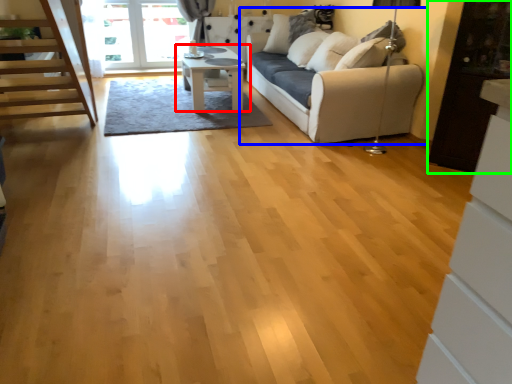
Question: Considering the real-world distances, which object is closest to table (highlighted by a red box)? studio couch (highlighted by a blue box) or cabinetry (highlighted by a green box).

Choices:
 (A) studio couch
 (B) cabinetry

Answer: (A)